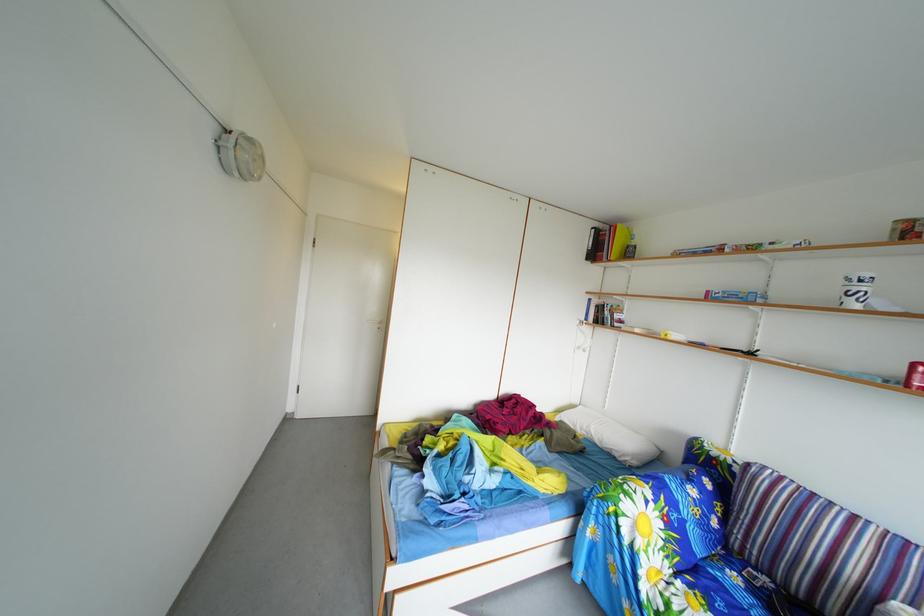
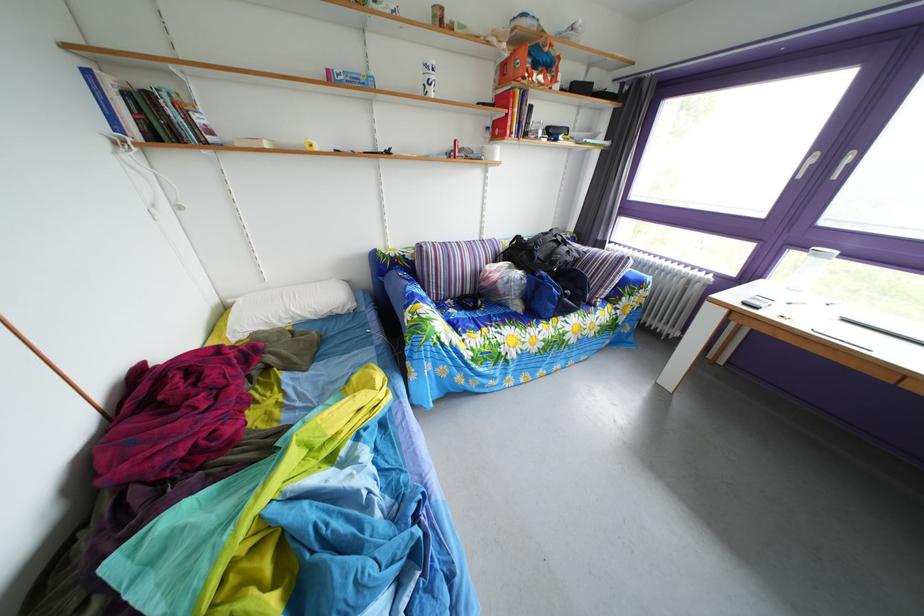
Find the pixel in the second image that matches pixel 746 585 in the first image.

(463, 320)